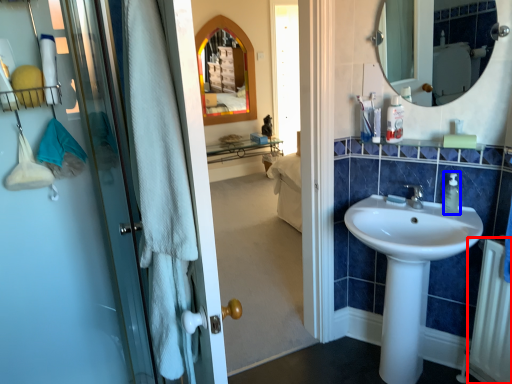
Question: Which object appears closest to the camera in this image, radiator (highlighted by a red box) or soap dispenser (highlighted by a blue box)?

Choices:
 (A) radiator
 (B) soap dispenser

Answer: (A)